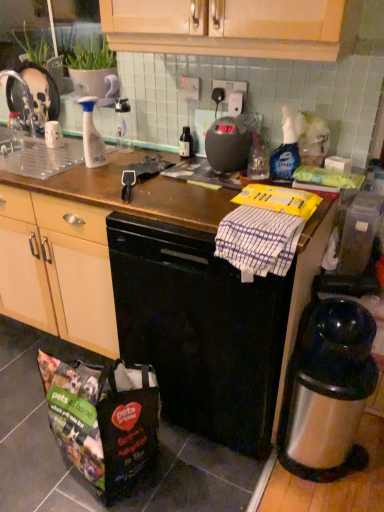
What are the coordinates of `free space on the front side of translucent plastic spray bottle at center-left, marked as the 1th bottle in a left-to-right arrangement` in the screenshot? It's located at (77, 182).